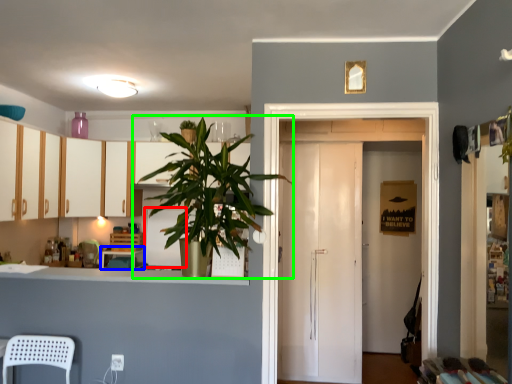
Question: Which object is positioned farthest from appliance (highlighted by a red box)? Select from table (highlighted by a blue box) and houseplant (highlighted by a green box).

Choices:
 (A) table
 (B) houseplant

Answer: (B)